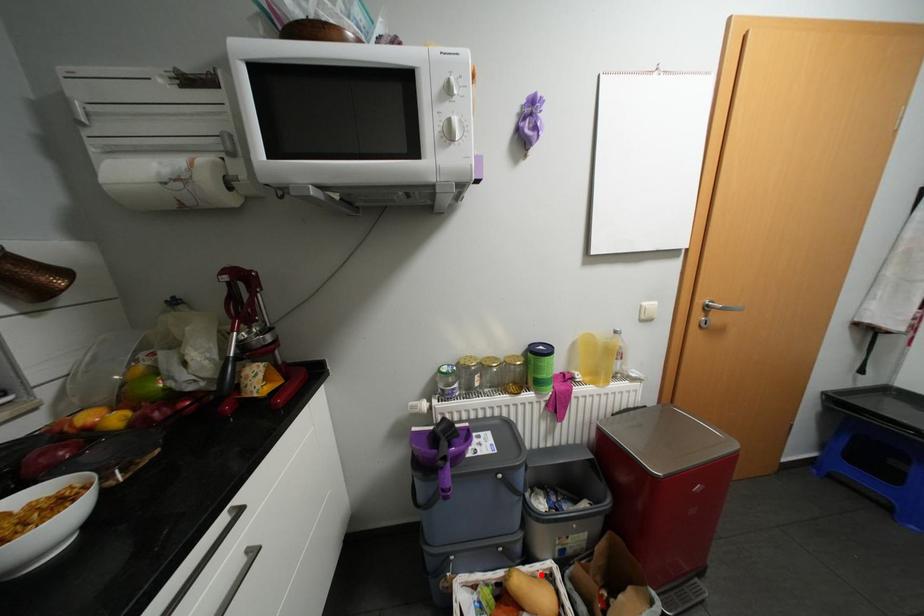
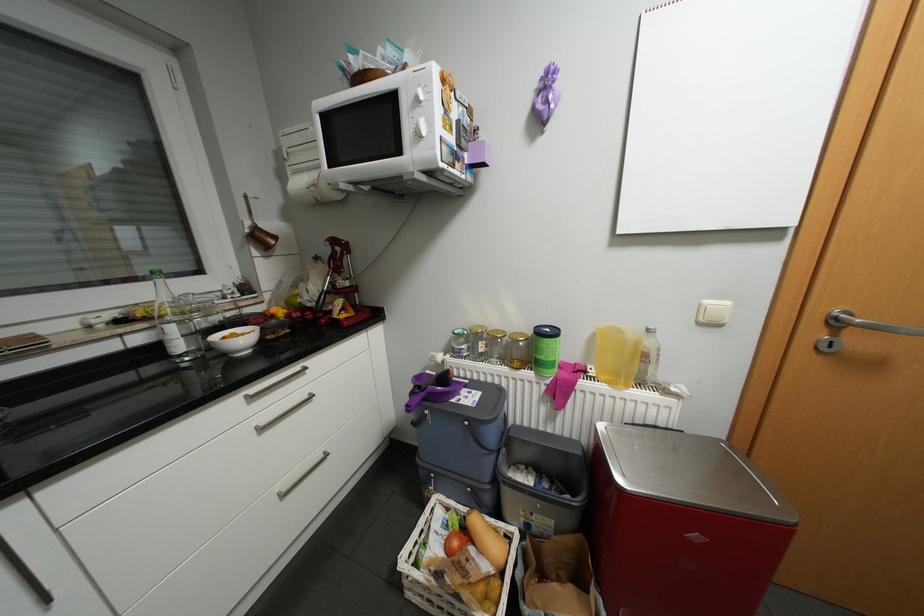
Where in the second image is the point corresponding to the highlighted location from the first image?

(504, 528)